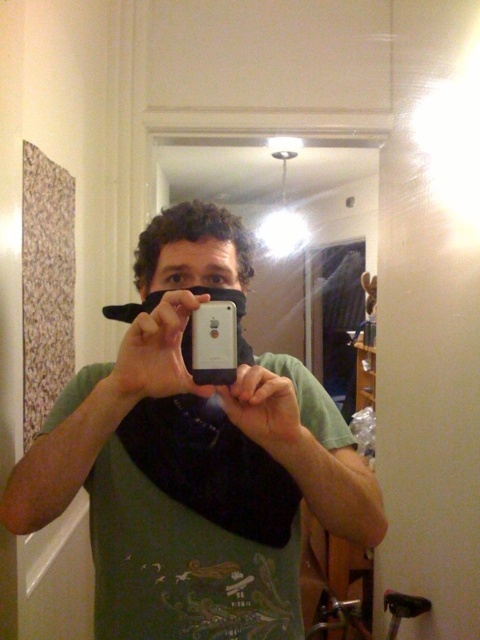
You are a photographer trying to adjust the focus on your camera. You notice two points in the scene labeled as point (192,236) and point (226,310). Which point should you focus on first if you want to ensure the closer one is sharp?

You should focus on point (192,236) first because it is closer to the camera than point (226,310).

You are trying to take a photo of the green matte shirt at center and the white matte smartphone at center. Based on their positions, which one would be more likely to be fully visible in the photo?

The white matte smartphone at center is more likely to be fully visible in the photo because the green matte shirt at center is positioned under it, meaning part of the shirt might be obscured by the smartphone in the image.

You are standing in the bathroom and want to place a small decorative item exactly at the point labeled as point (178, 326). If the item is 5 inches tall, will it be visible from your current position?

The distance of point (178, 326) from viewer is 23.70 inches. Since the item is only 5 inches tall, it may not be visible from 23.70 inches away unless it is placed in a prominent location. However, based on the given information, the visibility cannot be definitively determined as factors like angle and obstruction are not provided.